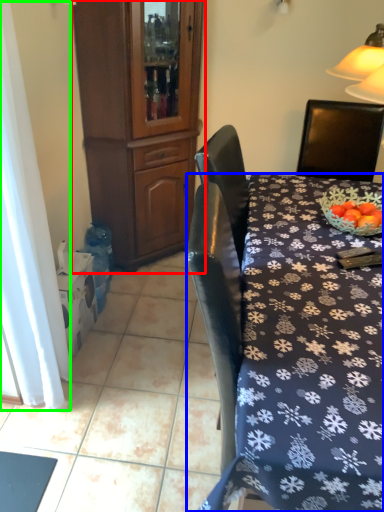
Question: Based on their relative distances, which object is farther from cabinetry (highlighted by a red box)? Choose from desk (highlighted by a blue box) and curtain (highlighted by a green box).

Choices:
 (A) desk
 (B) curtain

Answer: (A)